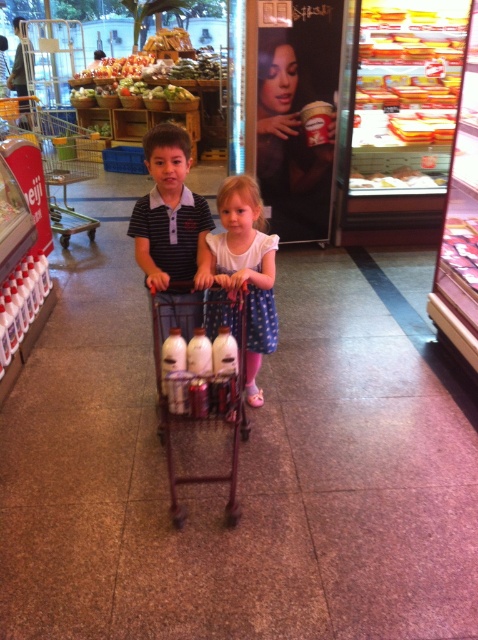
You are a customer in the grocery store and you want to reach the refrigerated section on the left. You see the white polka dot dress at center and the metallic silver trolley at center. Which object should you move around to get to the refrigerated section?

The white polka dot dress at center is positioned on the right side of metallic silver trolley at center. To reach the refrigerated section on the left, you should move around the metallic silver trolley at center which is blocking the path to the left side.

You are a customer in the grocery store and want to grab a cart quickly. There are two carts available, the metallic brown trolley at center and the metallic silver trolley at center. Which one can you reach first without moving from your current position?

The metallic brown trolley at center is closer to the viewer than the metallic silver trolley at center, so you can reach the metallic brown trolley at center first without moving.

Based on the photo, you are a customer in the grocery store and want to grab an item from the metallic brown trolley at center. However, there is a white polka dot dress at center in the way. Can you reach the trolley without moving the dress?

The white polka dot dress at center is further to the viewer than metallic brown trolley at center, so the dress is closer to you. Therefore, you cannot reach the trolley without moving the dress.